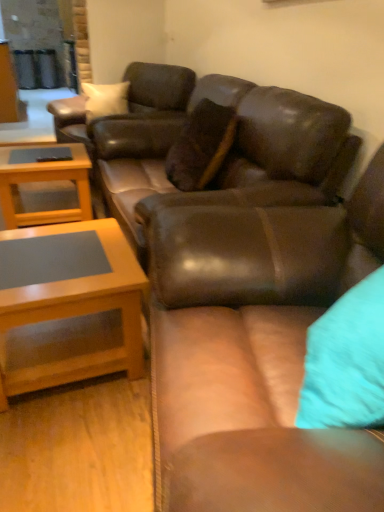
Question: In the image, is leather couch at center, marked as the 1th studio couch in a front-to-back arrangement, on the left side or the right side of light brown wood coffee table at lower left, acting as the second coffee table starting from the back?

Choices:
 (A) right
 (B) left

Answer: (A)

Question: Is leather couch at center, marked as the 1th studio couch in a front-to-back arrangement, wider or thinner than light brown wood coffee table at lower left, the first coffee table positioned from the front?

Choices:
 (A) thin
 (B) wide

Answer: (B)

Question: Which of these objects is positioned farthest from the light brown wood coffee table at lower left, acting as the second coffee table starting from the back?

Choices:
 (A) matte brown leather couch at center, which is the 1th studio couch from back to front
 (B) brown leather swivel chair at center
 (C) light brown wood coffee table at left, placed as the first coffee table when sorted from back to front
 (D) leather couch at center, marked as the 1th studio couch in a front-to-back arrangement

Answer: (B)

Question: Which of these objects is positioned farthest from the matte brown leather couch at center, which is the 1th studio couch from back to front?

Choices:
 (A) light brown wood coffee table at lower left, the 2th coffee table when ordered from top to bottom
 (B) brown leather swivel chair at center
 (C) light brown wood coffee table at left, placed as the first coffee table when sorted from back to front
 (D) leather couch at center, placed as the second studio couch when sorted from back to front

Answer: (D)